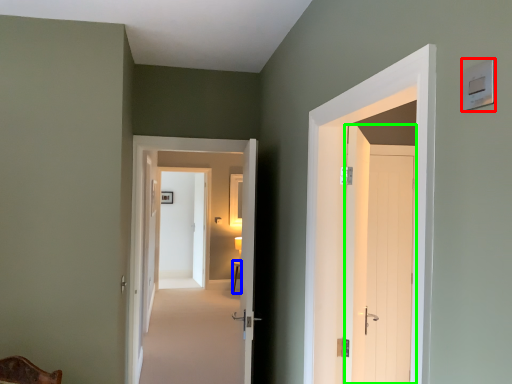
Question: Estimate the real-world distances between objects in this image. Which object is farther from light switch (highlighted by a red box), table (highlighted by a blue box) or door (highlighted by a green box)?

Choices:
 (A) table
 (B) door

Answer: (A)